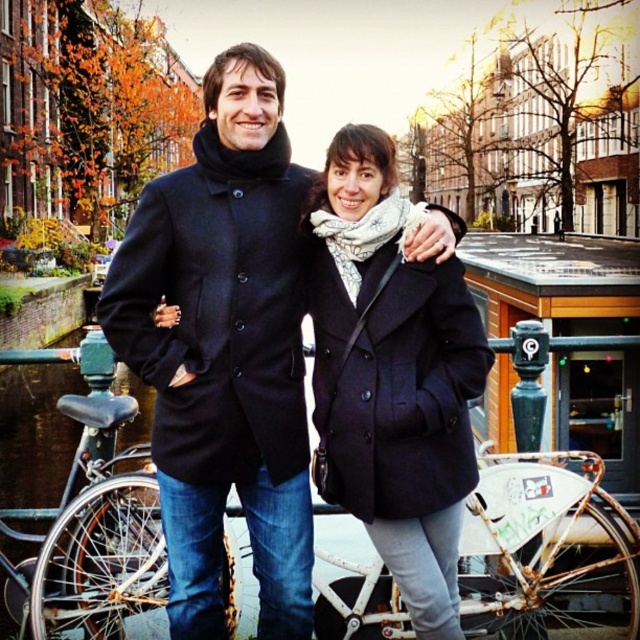
Describe the element at coordinates (225, 348) in the screenshot. I see `black wool coat at center` at that location.

Is black wool coat at center below matte black coat at center?

Actually, black wool coat at center is above matte black coat at center.

Find the location of a particular element. The image size is (640, 640). black wool coat at center is located at coordinates (225, 348).

Image resolution: width=640 pixels, height=640 pixels. What are the coordinates of `black wool coat at center` in the screenshot? It's located at (225, 348).